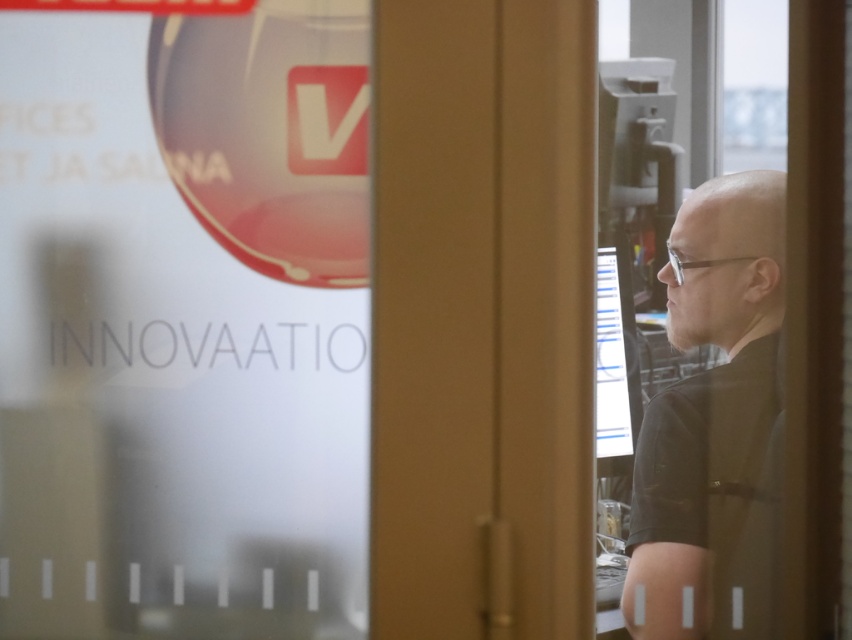
You are an interior designer assessing the space through the glass door. You notice the black matte shirt at right and the matte black monitor at center. Which object is wider?

The black matte shirt at right is wider than the matte black monitor at center.

You are standing in front of the glass door and want to touch the black matte shirt at right. What coordinates should you aim for?

You should aim for point coordinates at (x=711, y=419) to touch the black matte shirt at right.